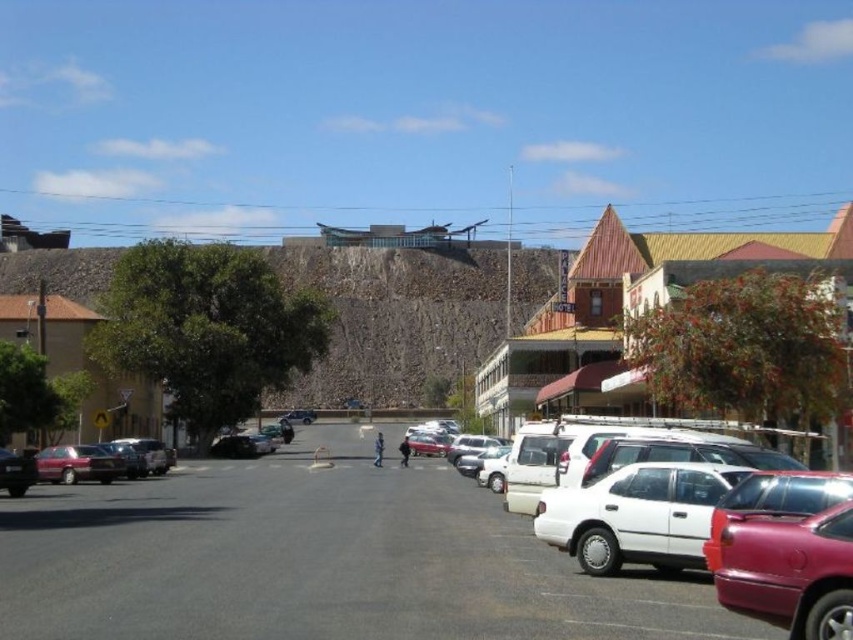
From the picture: Can you confirm if white matte car at center is positioned to the left of smooth concrete wall at center?

In fact, white matte car at center is to the right of smooth concrete wall at center.

Who is lower down, white matte car at center or smooth concrete wall at center?

white matte car at center is below.

Locate an element on the screen. The width and height of the screenshot is (853, 640). white matte car at center is located at coordinates (318, 560).

In the scene shown: Who is positioned more to the left, white matte car at center or white matte sedan at right?

Positioned to the left is white matte car at center.

The image size is (853, 640). What do you see at coordinates (318, 560) in the screenshot? I see `white matte car at center` at bounding box center [318, 560].

The image size is (853, 640). Identify the location of white matte car at center. (318, 560).

Which of these two, smooth concrete wall at center or matte red sedan at lower left, stands taller?

Standing taller between the two is smooth concrete wall at center.

Can you confirm if smooth concrete wall at center is positioned to the left of matte red sedan at lower left?

Incorrect, smooth concrete wall at center is not on the left side of matte red sedan at lower left.

Where is `smooth concrete wall at center`? The image size is (853, 640). smooth concrete wall at center is located at coordinates (518, 312).